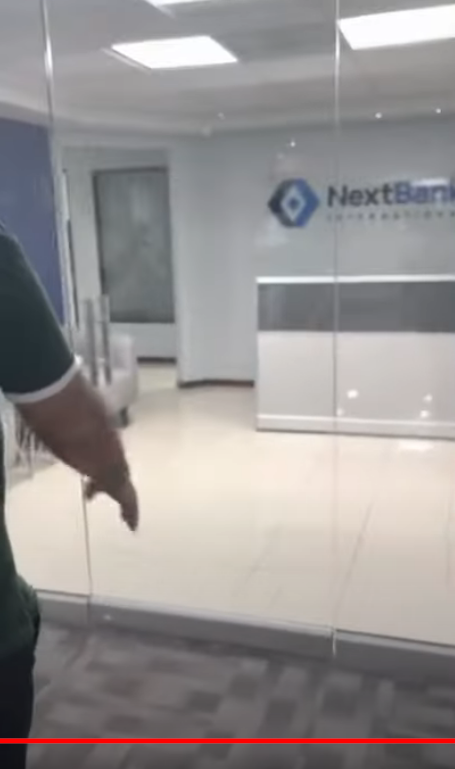
Where is `front desk`? This screenshot has height=769, width=455. front desk is located at coordinates (399, 310).